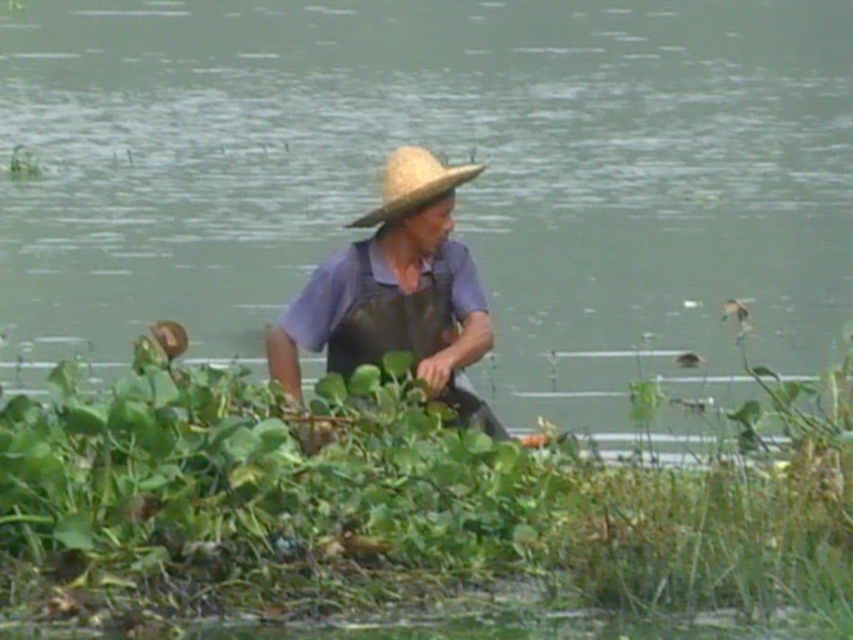
Between green leafy plants at lower center and strawmaterial/texturehat at center, which one appears on the right side from the viewer's perspective?

green leafy plants at lower center

Who is more distant from viewer, (228, 124) or (401, 163)?

The point (228, 124) is more distant.

Locate an element on the screen. green leafy plants at lower center is located at coordinates (450, 161).

Which is above, green leafy plants at lower center or matte straw hat at center?

green leafy plants at lower center

Can you confirm if green leafy plants at lower center is positioned above matte straw hat at center?

Correct, green leafy plants at lower center is located above matte straw hat at center.

Between point (610, 177) and point (340, 260), which one is positioned behind?

The point (610, 177) is more distant.

Locate an element on the screen. green leafy plants at lower center is located at coordinates (450, 161).

Does point (277, 65) come in front of point (27, 547)?

That is False.

Is green leafy plants at lower center shorter than green leafy plant at center?

No, green leafy plants at lower center is not shorter than green leafy plant at center.

Between point (815, 323) and point (169, 627), which one is positioned in front?

Point (169, 627)

Where is `green leafy plants at lower center`? The width and height of the screenshot is (853, 640). green leafy plants at lower center is located at coordinates (450, 161).